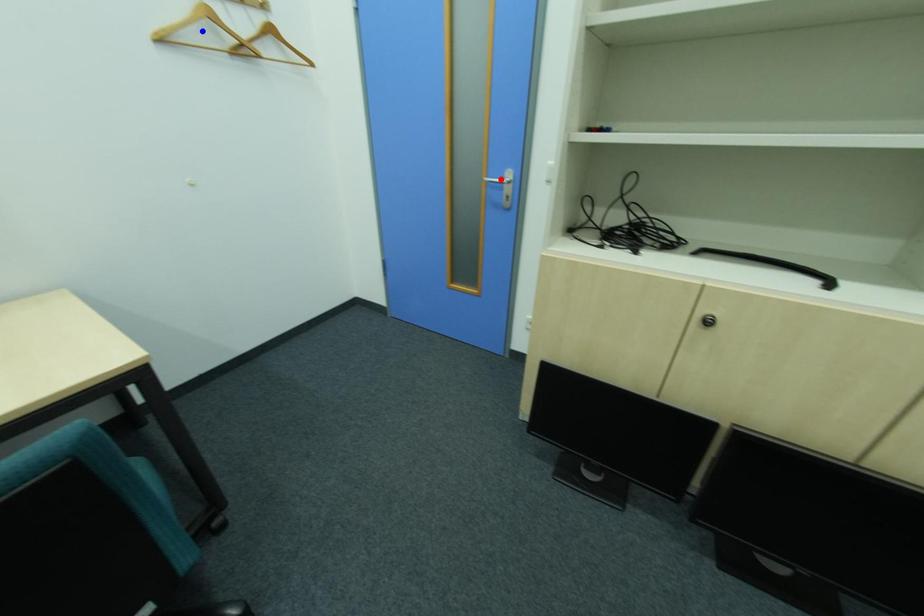
Question: Two points are marked on the image. Which point is closer to the camera?

Choices:
 (A) Blue point is closer.
 (B) Red point is closer.

Answer: (A)